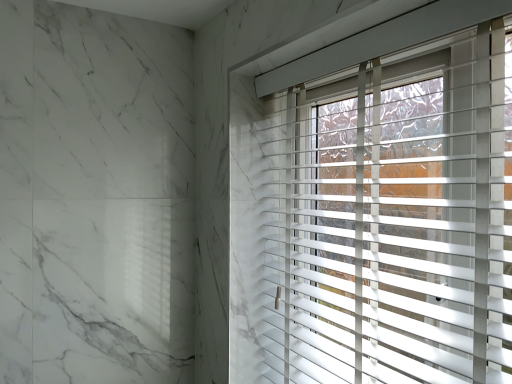
Question: Should I look upward or downward to see white plastic blinds at upper right?

Choices:
 (A) down
 (B) up

Answer: (A)